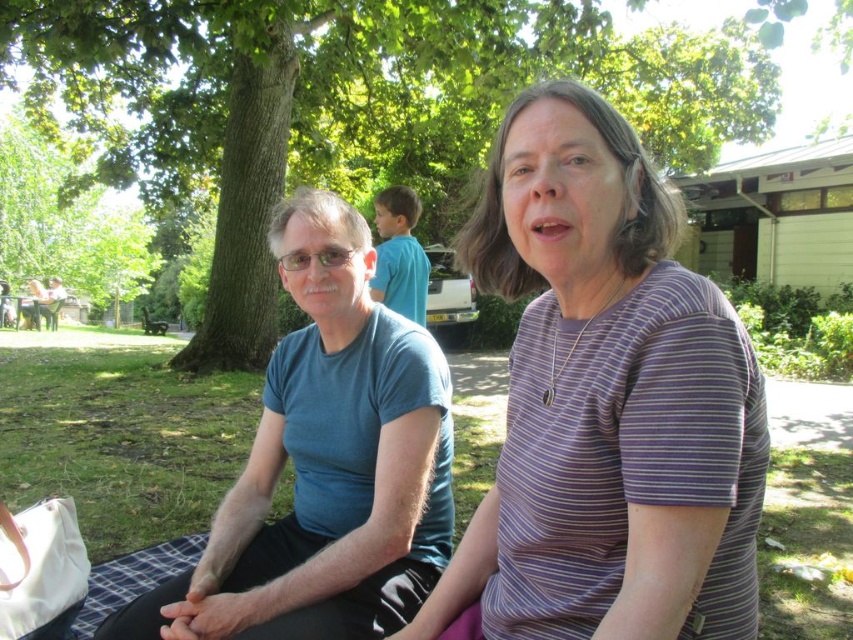
Between purple striped shirt at center and green leafy tree at center, which one appears on the right side from the viewer's perspective?

From the viewer's perspective, purple striped shirt at center appears more on the right side.

Is point (718, 614) closer to camera compared to point (708, 140)?

Yes, it is in front of point (708, 140).

I want to click on purple striped shirt at center, so click(605, 403).